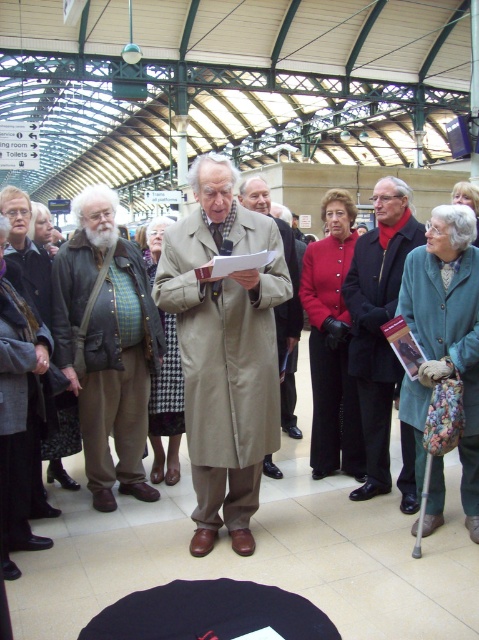
Question: Which object appears closest to the camera in this image?

Choices:
 (A) tan fabric coat at center
 (B) brown leather jacket at left
 (C) dark blue coat at center

Answer: (A)

Question: Does brown leather jacket at left have a smaller size compared to beige fabric coat at center?

Choices:
 (A) no
 (B) yes

Answer: (A)

Question: From the image, what is the correct spatial relationship of tan fabric coat at center in relation to dark blue coat at center?

Choices:
 (A) right
 (B) left

Answer: (B)

Question: Which object is the closest to the beige fabric coat at center?

Choices:
 (A) tan fabric coat at center
 (B) dark blue coat at center

Answer: (B)

Question: Which object is farther from the camera taking this photo?

Choices:
 (A) brown leather jacket at left
 (B) tan fabric coat at center
 (C) beige fabric coat at center

Answer: (C)

Question: Is dark blue coat at center thinner than beige fabric coat at center?

Choices:
 (A) yes
 (B) no

Answer: (B)